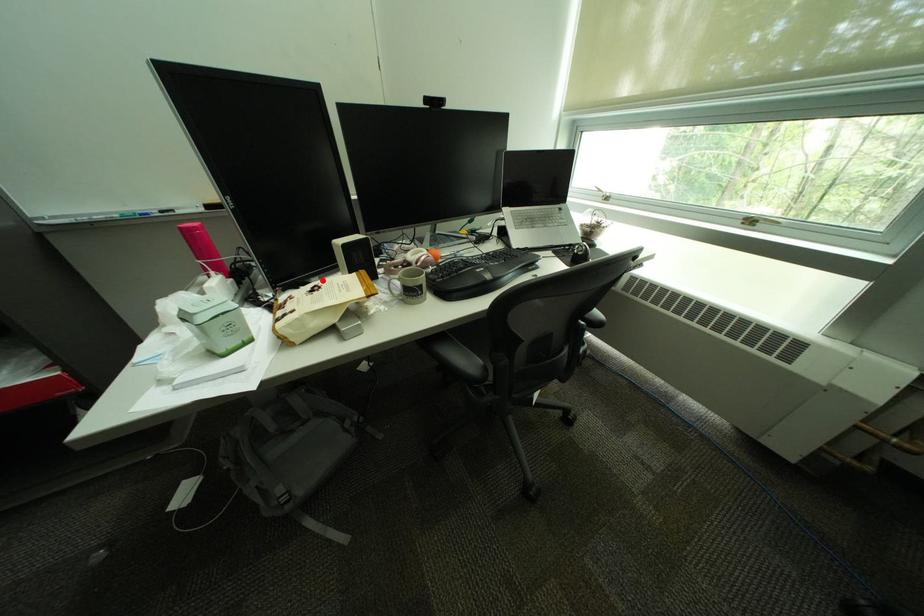
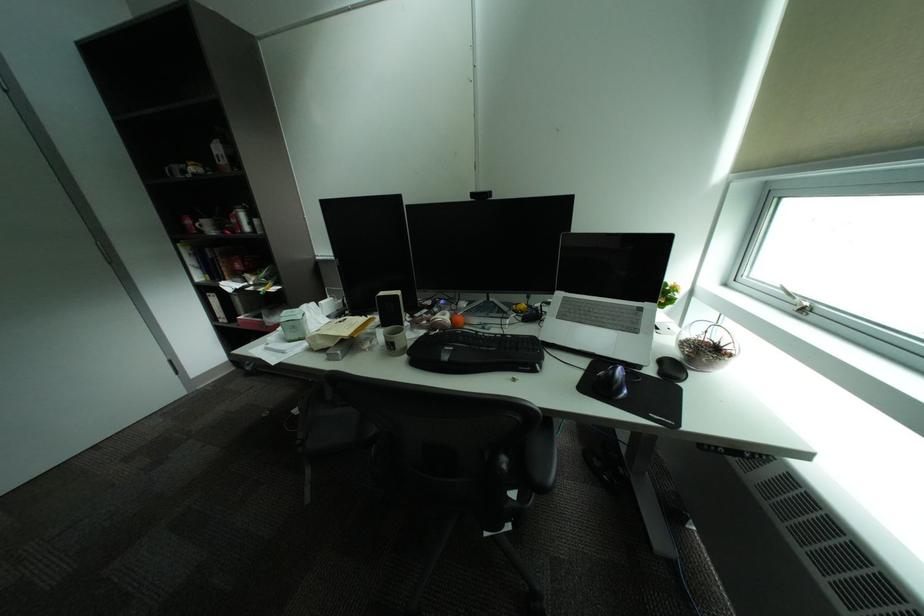
Where in the second image is the point corresponding to the highlighted location from the first image?

(385, 314)